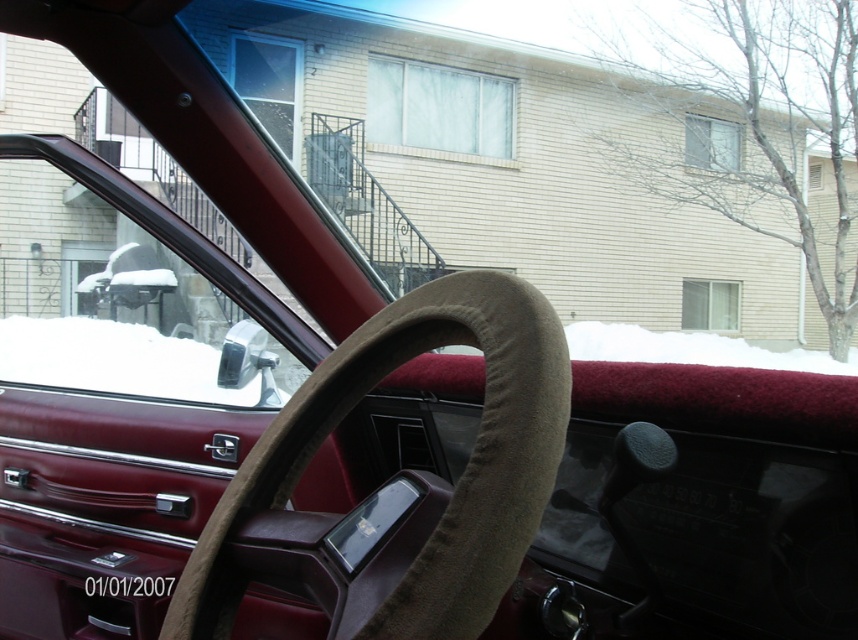
You are a passenger sitting in the back seat of the vintage car. You look through the windshield and see the brown suede steering wheel at center and the white fluffy snow at center. Which object is closer to you?

The brown suede steering wheel at center is closer to you because it is positioned over the white fluffy snow at center, indicating it is in front of the snow.

Consider the image. You are sitting in the driver seat of the vintage car. You need to adjust the rearview mirror which is on the top of the windshield. To do that, you have to reach over the brown suede steering wheel at center. Which direction should you move your hand relative to the steering wheel to reach the mirror?

The brown suede steering wheel at center is located at point (426, 484). Since the rearview mirror is on the top of the windshield, you should move your hand upward and away from the steering wheel towards the windshield.

You are a driver sitting in the vintage car. The car has a brown suede steering wheel at center. You need to reach for a glove compartment that is located 29.06 inches away from the steering wheel. Can you comfortably reach it while keeping both hands on the steering wheel?

The glove compartment is 29.06 inches away from the brown suede steering wheel at center. Since the average comfortable reaching distance while keeping both hands on the steering wheel is typically around 24 inches, this distance may be a bit too far for most drivers to comfortably reach without letting go of the wheel.